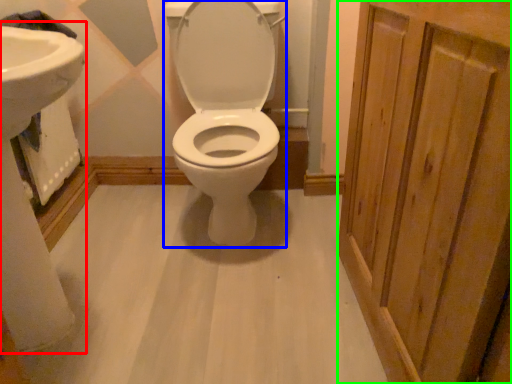
Question: Considering the real-world distances, which object is closest to sink (highlighted by a red box)? toilet (highlighted by a blue box) or screen door (highlighted by a green box).

Choices:
 (A) toilet
 (B) screen door

Answer: (A)